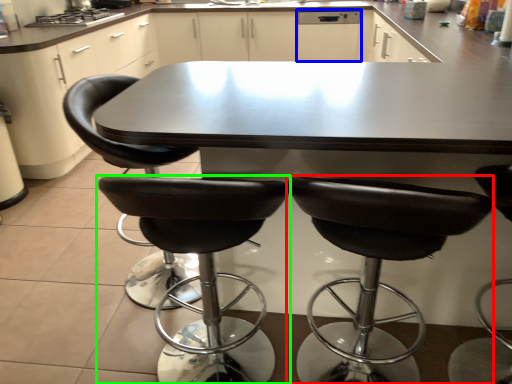
Question: Which object is positioned closest to chair (highlighted by a red box)? Select from dish washer (highlighted by a blue box) and chair (highlighted by a green box).

Choices:
 (A) dish washer
 (B) chair

Answer: (B)